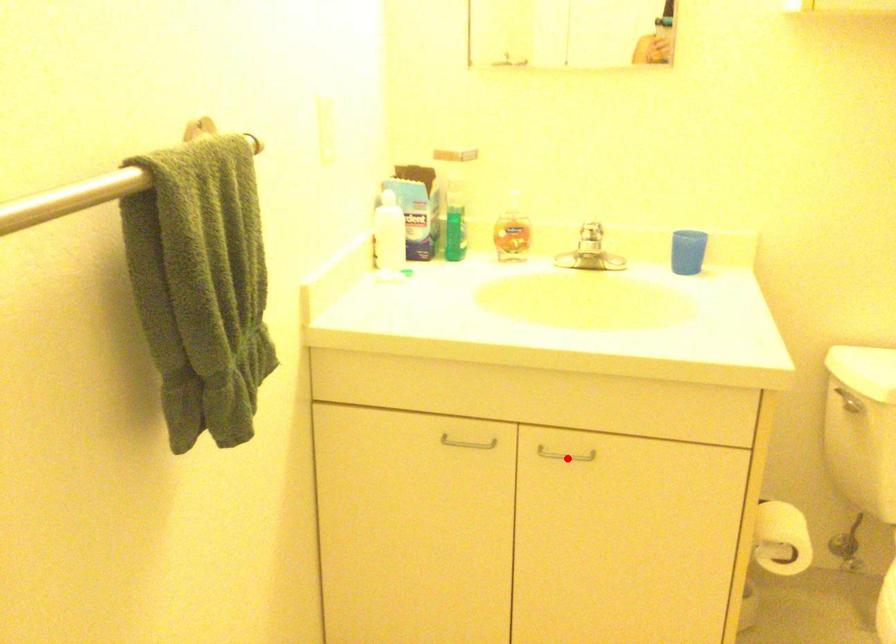
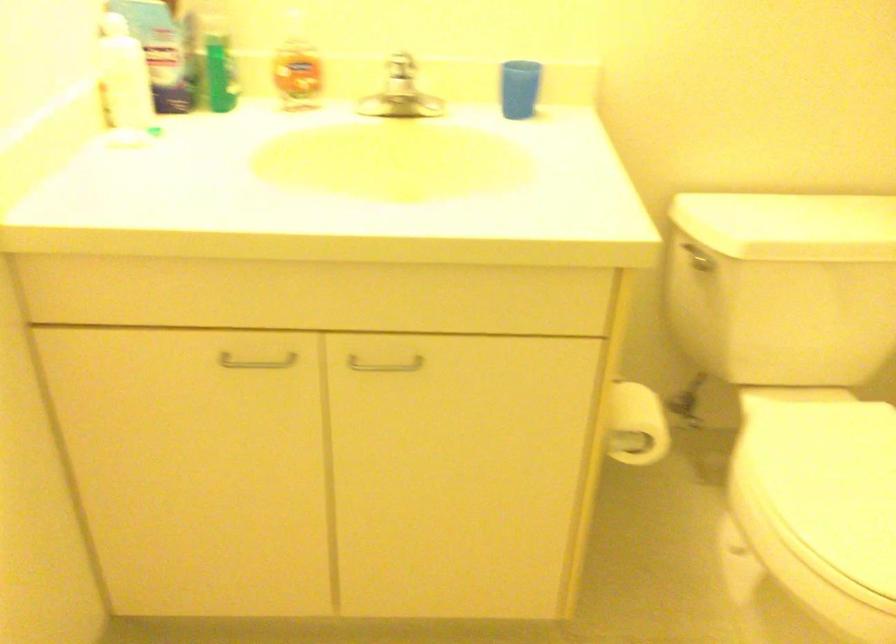
The point at the highlighted location is marked in the first image. Where is the corresponding point in the second image?

(384, 365)